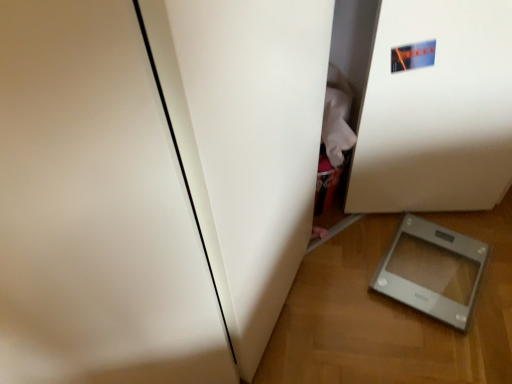
I want to click on empty space that is to the right of silver plastic scale at lower right, so click(x=490, y=259).